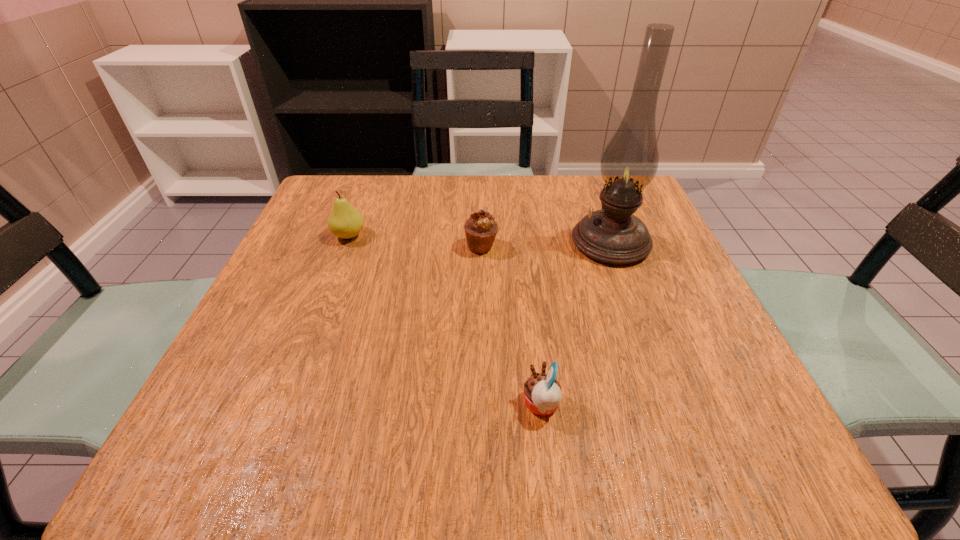
Where is `free space located on the front-facing side of the shorter muffin`? The image size is (960, 540). free space located on the front-facing side of the shorter muffin is located at coordinates [331, 404].

The height and width of the screenshot is (540, 960). What are the coordinates of `blank area located on the front-facing side of the shorter muffin` in the screenshot? It's located at (303, 404).

You are a GUI agent. You are given a task and a screenshot of the screen. Output one action in this format:
    pyautogui.click(x=<x>, y=<y>)
    Task: Click on the vacant area situated 0.350m on the front-facing side of the shorter muffin
    This screenshot has width=960, height=540.
    Given the screenshot: What is the action you would take?
    pyautogui.click(x=283, y=404)

The height and width of the screenshot is (540, 960). Identify the location of oil lamp situated at the far edge. (612, 235).

Find the location of `pear situated at the far edge`. pear situated at the far edge is located at coordinates (345, 221).

This screenshot has width=960, height=540. I want to click on object at the near edge, so pos(542,392).

The height and width of the screenshot is (540, 960). Identify the location of object that is at the left edge. (345, 221).

Where is `object that is at the right edge`? object that is at the right edge is located at coordinates (612, 235).

The height and width of the screenshot is (540, 960). Find the location of `object positioned at the far left corner`. object positioned at the far left corner is located at coordinates (x=345, y=221).

Locate an element on the screen. Image resolution: width=960 pixels, height=540 pixels. object located at the far right corner is located at coordinates (612, 235).